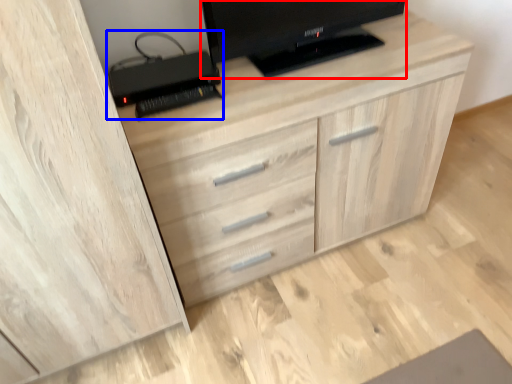
Question: Which of the following is the closest to the observer, television (highlighted by a red box) or computer (highlighted by a blue box)?

Choices:
 (A) television
 (B) computer

Answer: (A)